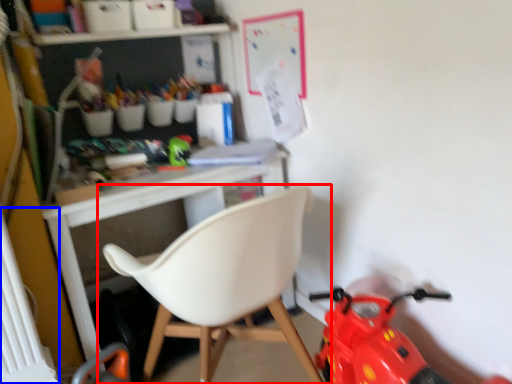
Question: Which object appears farthest to the camera in this image, chair (highlighted by a red box) or radiator (highlighted by a blue box)?

Choices:
 (A) chair
 (B) radiator

Answer: (B)